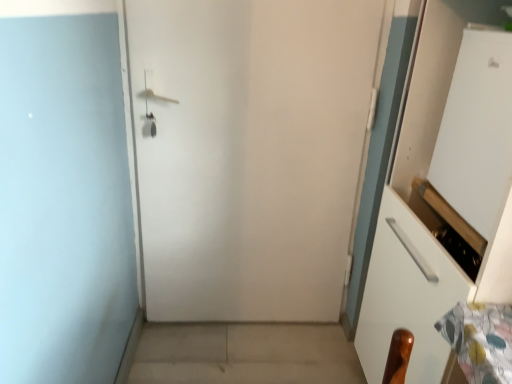
Question: Considering the positions of point (508, 178) and point (260, 329), is point (508, 178) closer or farther from the camera than point (260, 329)?

Choices:
 (A) closer
 (B) farther

Answer: (A)

Question: In terms of size, does white glossy screen door at upper right appear bigger or smaller than beige concrete at lower center?

Choices:
 (A) big
 (B) small

Answer: (A)

Question: Which of these objects is positioned farthest from the white matte door at center?

Choices:
 (A) white glossy screen door at upper right
 (B) beige concrete at lower center

Answer: (A)

Question: Which object is positioned farthest from the beige concrete at lower center?

Choices:
 (A) white matte door at center
 (B) white glossy screen door at upper right

Answer: (B)